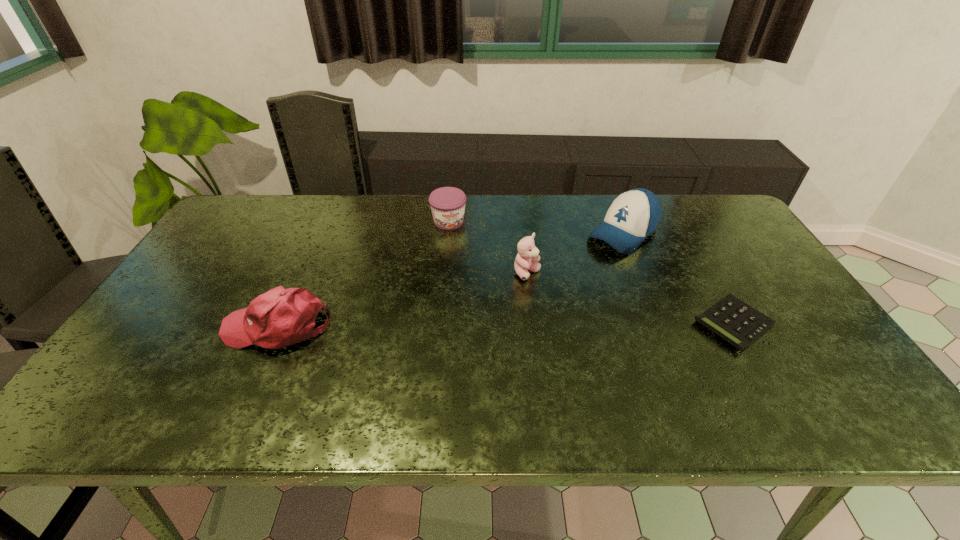
What are the coordinates of `the nearer baseball cap` in the screenshot? It's located at (281, 317).

At what (x,y) coordinates should I click in order to perform the action: click on the leftmost object. Please return your answer as a coordinate pair (x, y). This screenshot has height=540, width=960. Looking at the image, I should click on (281, 317).

Where is `calculator`? This screenshot has width=960, height=540. calculator is located at coordinates (738, 323).

Image resolution: width=960 pixels, height=540 pixels. I want to click on the second shortest object, so click(447, 204).

Identify the location of the second object from left to right. Image resolution: width=960 pixels, height=540 pixels. pyautogui.click(x=447, y=204).

Where is `the third nearest object`? the third nearest object is located at coordinates tap(527, 258).

The height and width of the screenshot is (540, 960). What are the coordinates of `teddy bear` in the screenshot? It's located at (527, 258).

You are a GUI agent. You are given a task and a screenshot of the screen. Output one action in this format:
    pyautogui.click(x=<x>, y=<y>)
    Task: Click on the farther baseball cap
    The image size is (960, 540).
    Given the screenshot: What is the action you would take?
    pyautogui.click(x=633, y=215)

Find the location of a particular element. blank area located 0.060m at the front of the nearer baseball cap with the brim is located at coordinates (200, 327).

The width and height of the screenshot is (960, 540). In order to click on vacant region located at the front of the nearer baseball cap with the brim in this screenshot , I will do `click(204, 327)`.